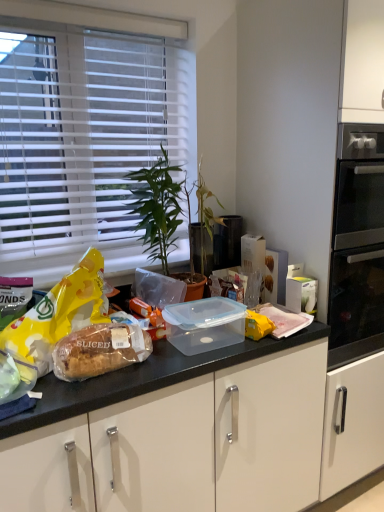
Question: Considering the relative sizes of black plastic trash can at center and white plastic blinds at upper left in the image provided, is black plastic trash can at center bigger than white plastic blinds at upper left?

Choices:
 (A) no
 (B) yes

Answer: (A)

Question: Is black plastic trash can at center not close to white plastic blinds at upper left?

Choices:
 (A) yes
 (B) no

Answer: (B)

Question: Is black plastic trash can at center at the right side of white plastic blinds at upper left?

Choices:
 (A) no
 (B) yes

Answer: (B)

Question: Is black plastic trash can at center outside of white plastic blinds at upper left?

Choices:
 (A) yes
 (B) no

Answer: (A)

Question: From the image's perspective, would you say black plastic trash can at center is positioned over white plastic blinds at upper left?

Choices:
 (A) yes
 (B) no

Answer: (B)

Question: Could you tell me if black plastic trash can at center is turned towards white plastic blinds at upper left?

Choices:
 (A) no
 (B) yes

Answer: (A)

Question: Is white plastic blinds at upper left behind green leafy plant at center?

Choices:
 (A) no
 (B) yes

Answer: (B)

Question: From a real-world perspective, is white plastic blinds at upper left under green leafy plant at center?

Choices:
 (A) no
 (B) yes

Answer: (A)

Question: Is white plastic blinds at upper left placed right next to green leafy plant at center?

Choices:
 (A) no
 (B) yes

Answer: (A)

Question: Is white plastic blinds at upper left smaller than green leafy plant at center?

Choices:
 (A) yes
 (B) no

Answer: (A)

Question: Considering the relative positions of white plastic blinds at upper left and green leafy plant at center in the image provided, is white plastic blinds at upper left in front of green leafy plant at center?

Choices:
 (A) yes
 (B) no

Answer: (B)

Question: Could you tell me if white plastic blinds at upper left is turned towards green leafy plant at center?

Choices:
 (A) no
 (B) yes

Answer: (B)

Question: Is green leafy plant at center in front of yellow matte snack at left?

Choices:
 (A) no
 (B) yes

Answer: (A)